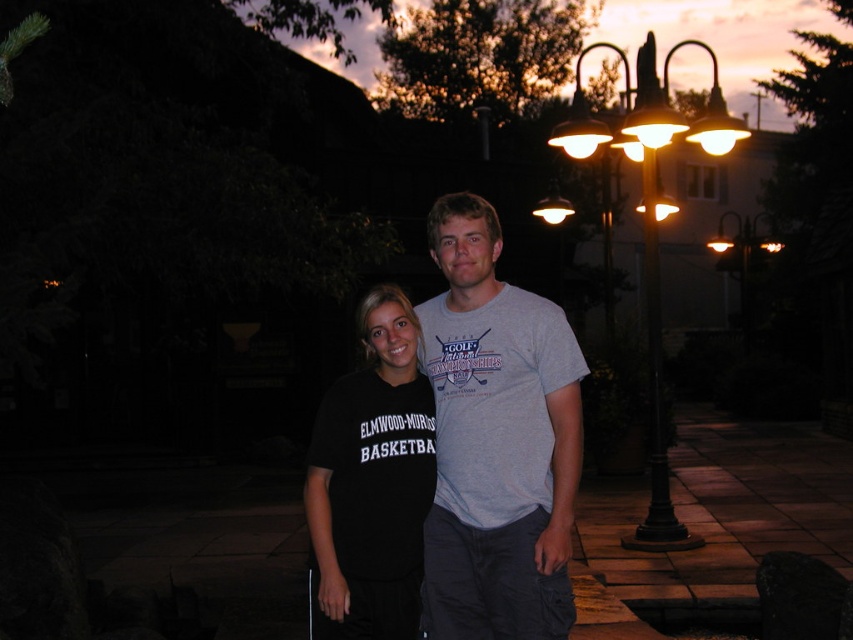
Question: Does gray cotton t-shirt at center have a larger size compared to metallic streetlamp at right?

Choices:
 (A) yes
 (B) no

Answer: (B)

Question: Based on their relative distances, which object is farther from the metallic streetlamp at right?

Choices:
 (A) black matte t-shirt at center
 (B) gray cotton t-shirt at center

Answer: (B)

Question: Does black matte t-shirt at center appear on the left side of metallic streetlamp at right?

Choices:
 (A) yes
 (B) no

Answer: (A)

Question: In this image, where is gray cotton t-shirt at center located relative to metallic streetlamp at right?

Choices:
 (A) left
 (B) right

Answer: (A)

Question: Which object appears farthest from the camera in this image?

Choices:
 (A) metallic streetlamp at right
 (B) black matte t-shirt at center
 (C) gray cotton t-shirt at center

Answer: (A)

Question: Considering the real-world distances, which object is farthest from the black matte t-shirt at center?

Choices:
 (A) metallic streetlamp at right
 (B) gray cotton t-shirt at center

Answer: (A)